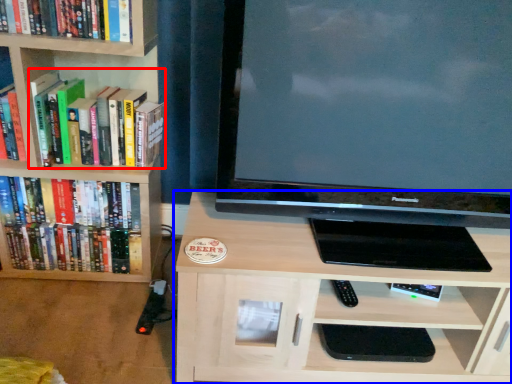
Question: Which object is further to the camera taking this photo, book (highlighted by a red box) or shelf (highlighted by a blue box)?

Choices:
 (A) book
 (B) shelf

Answer: (A)